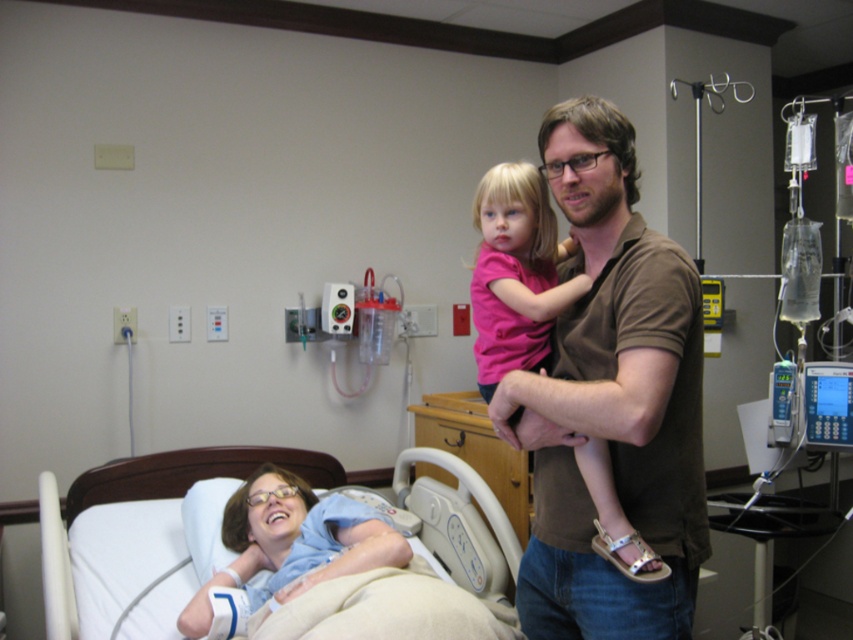
Is white fabric bed at lower left below blue cotton shirt at lower left?

Yes.

Does white fabric bed at lower left come in front of blue cotton shirt at lower left?

Yes, it is in front of blue cotton shirt at lower left.

Does point (192, 584) lie in front of point (291, 547)?

No.

Identify the location of white fabric bed at lower left. (132, 525).

Based on the photo, who is higher up, brown cotton shirt at center or white fabric bed at lower left?

brown cotton shirt at center

Who is shorter, brown cotton shirt at center or white fabric bed at lower left?

With less height is white fabric bed at lower left.

Measure the distance between brown cotton shirt at center and camera.

They are 1.23 meters apart.

In order to click on brown cotton shirt at center in this screenshot , I will do `click(611, 400)`.

Which is in front, point (633, 198) or point (308, 520)?

Point (633, 198) is in front.

Can you confirm if brown cotton shirt at center is bigger than blue cotton shirt at lower left?

Yes.

Locate an element on the screen. This screenshot has width=853, height=640. brown cotton shirt at center is located at coordinates (611, 400).